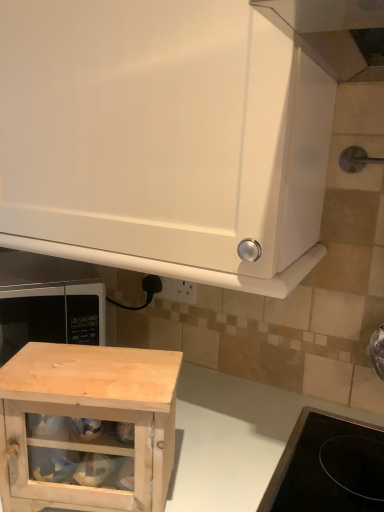
I want to click on vacant area on top of natural wood cabinet at lower left, which is counted as the first cabinetry, starting from the bottom (from a real-world perspective), so [85, 372].